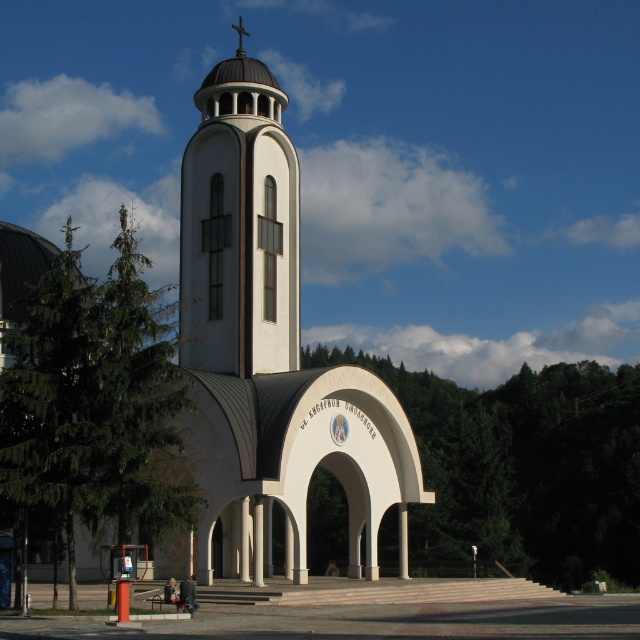
Question: Where is white smooth tower at center located in relation to white concrete pillar at center in the image?

Choices:
 (A) left
 (B) right

Answer: (A)

Question: Does white marble pillar at center lie in front of white concrete pillar at center?

Choices:
 (A) no
 (B) yes

Answer: (B)

Question: Does white smooth pillar at center have a lesser width compared to white concrete pillar at center?

Choices:
 (A) no
 (B) yes

Answer: (B)

Question: Which object is farther from the camera taking this photo?

Choices:
 (A) white smooth tower at center
 (B) white concrete pillar at center
 (C) white marble pillar at center
 (D) white smooth pillar at center

Answer: (B)

Question: Which of the following is the farthest from the observer?

Choices:
 (A) white marble pillar at center
 (B) white smooth tower at center
 (C) white smooth pillar at center

Answer: (B)

Question: Among these objects, which one is farthest from the camera?

Choices:
 (A) white smooth pillar at center
 (B) white marble pillar at center
 (C) white concrete pillar at center

Answer: (C)